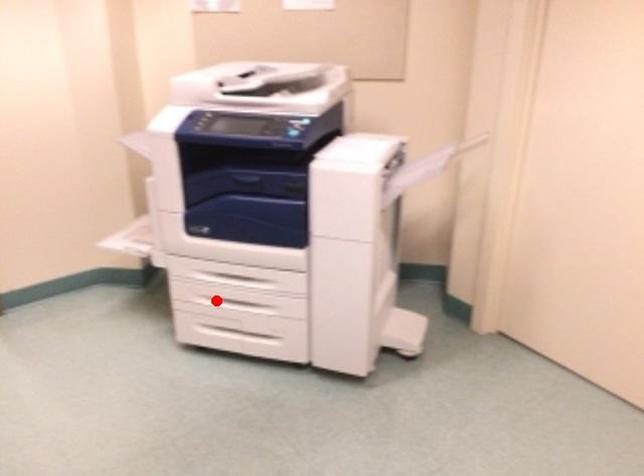
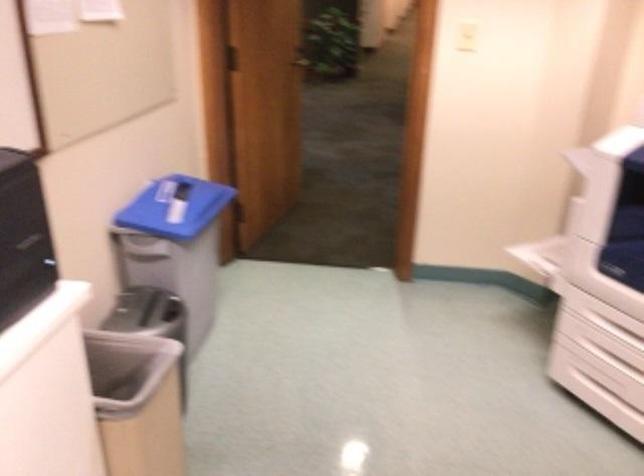
Question: A red point is marked in image1. In image2, is the corresponding 3D point closer to the camera or farther? Reply with the corresponding letter.

Choices:
 (A) The corresponding 3D point is closer.
 (B) The corresponding 3D point is farther.

Answer: (A)